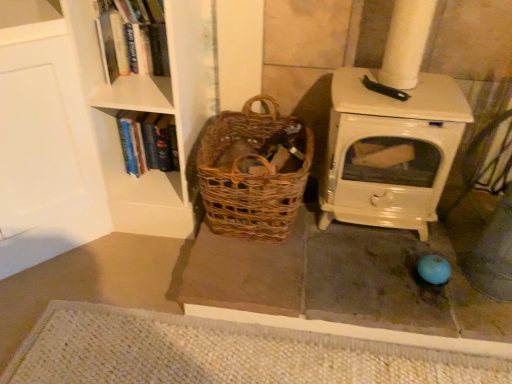
Question: Should I look upward or downward to see hardcover book at left, placed as the second book when sorted from front to back?

Choices:
 (A) down
 (B) up

Answer: (B)

Question: From a real-world perspective, does hardcover book at left, placed as the second book when sorted from front to back, sit lower than white woven mat at lower center?

Choices:
 (A) yes
 (B) no

Answer: (B)

Question: Considering the relative positions of hardcover book at left, the 2th book from the top, and white woven mat at lower center in the image provided, is hardcover book at left, the 2th book from the top, behind white woven mat at lower center?

Choices:
 (A) yes
 (B) no

Answer: (A)

Question: Does hardcover book at left, placed as the first book when sorted from back to front, have a larger size compared to white woven mat at lower center?

Choices:
 (A) yes
 (B) no

Answer: (B)

Question: Does hardcover book at left, placed as the first book when sorted from back to front, have a greater height compared to white woven mat at lower center?

Choices:
 (A) yes
 (B) no

Answer: (A)

Question: Is hardcover book at left, the 2th book from the top, oriented towards white woven mat at lower center?

Choices:
 (A) no
 (B) yes

Answer: (A)

Question: Does hardcover book at left, placed as the second book when sorted from front to back, appear on the right side of white woven mat at lower center?

Choices:
 (A) no
 (B) yes

Answer: (A)

Question: Does woven brown basket at center have a lesser width compared to hardcover book at left, the 2th book from the top?

Choices:
 (A) yes
 (B) no

Answer: (B)

Question: Does woven brown basket at center have a greater width compared to hardcover book at left, placed as the second book when sorted from front to back?

Choices:
 (A) yes
 (B) no

Answer: (A)

Question: Does woven brown basket at center have a lesser height compared to hardcover book at left, the 2th book from the top?

Choices:
 (A) no
 (B) yes

Answer: (A)

Question: Is woven brown basket at center not inside hardcover book at left, placed as the first book when sorted from back to front?

Choices:
 (A) no
 (B) yes

Answer: (B)

Question: Does woven brown basket at center have a greater height compared to hardcover book at left, the 2th book from the top?

Choices:
 (A) no
 (B) yes

Answer: (B)

Question: Can you confirm if woven brown basket at center is smaller than hardcover book at left, which is the first book in bottom-to-top order?

Choices:
 (A) yes
 (B) no

Answer: (B)

Question: Considering the relative sizes of hardcover book at left, placed as the second book when sorted from front to back, and hardcover book at upper left, which is the 2th book in back-to-front order, in the image provided, is hardcover book at left, placed as the second book when sorted from front to back, smaller than hardcover book at upper left, which is the 2th book in back-to-front order,?

Choices:
 (A) no
 (B) yes

Answer: (A)